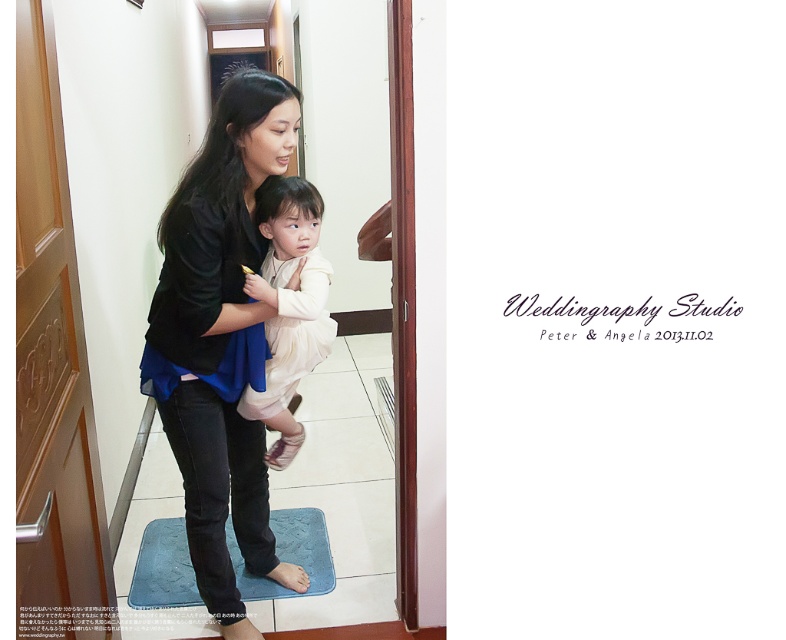
Consider the image. Between black matte jacket at center and blue textured mat at lower center, which one appears on the right side from the viewer's perspective?

From the viewer's perspective, black matte jacket at center appears more on the right side.

Does point (241, 180) lie behind point (320, 540)?

No, (241, 180) is closer to viewer.

Where is `black matte jacket at center`? black matte jacket at center is located at coordinates (219, 339).

Between black matte jacket at center and ivory satin dress at center, which one appears on the right side from the viewer's perspective?

ivory satin dress at center is more to the right.

Consider the image. Is black matte jacket at center thinner than ivory satin dress at center?

No.

The width and height of the screenshot is (786, 640). Identify the location of black matte jacket at center. (219, 339).

The width and height of the screenshot is (786, 640). I want to click on black matte jacket at center, so 219,339.

Which of these two, ivory satin dress at center or blue textured mat at lower center, stands shorter?

With less height is blue textured mat at lower center.

Does ivory satin dress at center have a greater height compared to blue textured mat at lower center?

Yes.

Between point (281, 337) and point (281, 595), which one is positioned in front?

Point (281, 337) is more forward.

I want to click on ivory satin dress at center, so click(288, 307).